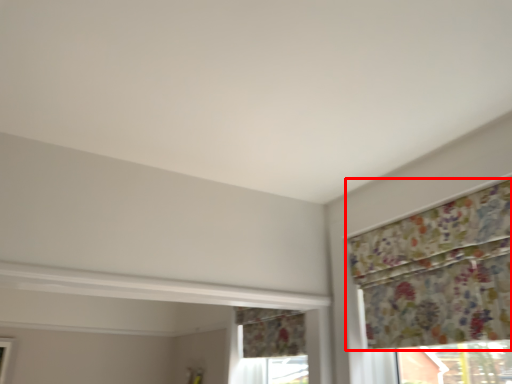
Question: From the image, what is the correct spatial relationship of curtain (annotated by the red box) in relation to window?

Choices:
 (A) left
 (B) right

Answer: (B)